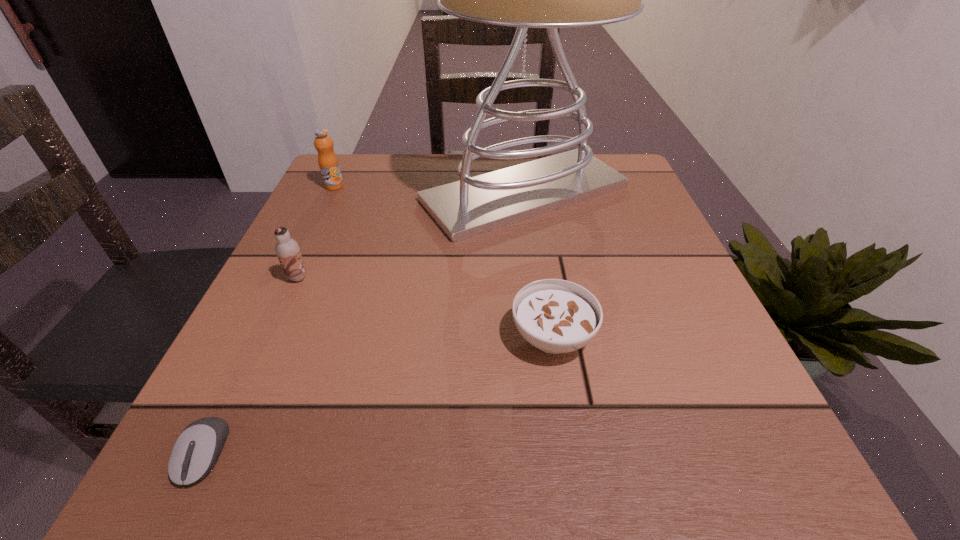
Image resolution: width=960 pixels, height=540 pixels. What are the coordinates of `free space located 0.300m on the right of the third farthest object` in the screenshot? It's located at (476, 278).

The width and height of the screenshot is (960, 540). I want to click on vacant space situated on the back of the second nearest object, so click(533, 212).

Where is `table lamp at the far edge`? table lamp at the far edge is located at coordinates (474, 205).

Where is `orange juice that is at the far edge`? This screenshot has height=540, width=960. orange juice that is at the far edge is located at coordinates (328, 162).

You are a GUI agent. You are given a task and a screenshot of the screen. Output one action in this format:
    pyautogui.click(x=<x>, y=<y>)
    Task: Click on the object that is positioned at the near edge
    
    Given the screenshot: What is the action you would take?
    tap(195, 452)

Where is `orange juice positioned at the left edge`? The height and width of the screenshot is (540, 960). orange juice positioned at the left edge is located at coordinates (328, 162).

This screenshot has width=960, height=540. Identify the location of chocolate milk that is at the left edge. (287, 250).

Find the location of `computer equipment that is at the left edge`. computer equipment that is at the left edge is located at coordinates (195, 452).

Locate an element on the screen. The width and height of the screenshot is (960, 540). object that is at the right edge is located at coordinates (474, 205).

Image resolution: width=960 pixels, height=540 pixels. Find the location of `object situated at the far left corner`. object situated at the far left corner is located at coordinates (328, 162).